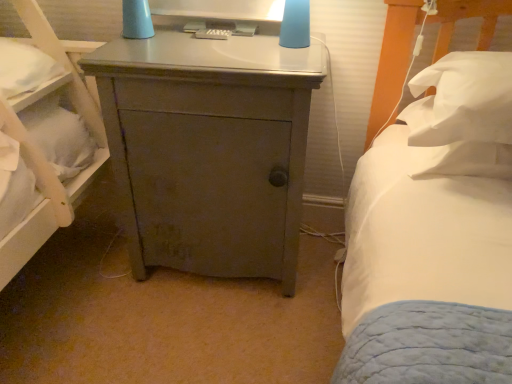
The height and width of the screenshot is (384, 512). What do you see at coordinates (462, 100) in the screenshot? I see `white soft pillow at right, positioned as the second pillow in bottom-to-top order` at bounding box center [462, 100].

Identify the location of matte blue lampshade at upper center. The width and height of the screenshot is (512, 384). (295, 24).

Is matte plastic remote control at upper center looking in the opposite direction of white soft pillow at right, positioned as the second pillow in bottom-to-top order?

No.

Is matte plastic remote control at upper center next to white soft pillow at right, positioned as the second pillow in bottom-to-top order?

No, matte plastic remote control at upper center is not in contact with white soft pillow at right, positioned as the second pillow in bottom-to-top order.

From a real-world perspective, relative to white soft pillow at right, positioned as the second pillow in bottom-to-top order, is matte plastic remote control at upper center vertically above or below?

In terms of real-world spatial position, matte plastic remote control at upper center is above white soft pillow at right, positioned as the second pillow in bottom-to-top order.

From the image's perspective, between matte blue lampshade at upper center and matte gray cabinet at center, which one is located above?

From the image's view, matte blue lampshade at upper center is above.

Consider the image. How many degrees apart are the facing directions of matte blue lampshade at upper center and matte gray cabinet at center?

The angle between the facing direction of matte blue lampshade at upper center and the facing direction of matte gray cabinet at center is 0.49 degrees.

Is matte blue lampshade at upper center at the left side of matte gray cabinet at center?

No, matte blue lampshade at upper center is not to the left of matte gray cabinet at center.

Is matte blue lampshade at upper center beside matte gray cabinet at center?

No, matte blue lampshade at upper center is not making contact with matte gray cabinet at center.

Is matte gray cabinet at center to the right of matte plastic remote control at upper center from the viewer's perspective?

Yes, matte gray cabinet at center is to the right of matte plastic remote control at upper center.

Is the surface of matte gray cabinet at center in direct contact with matte plastic remote control at upper center?

No.

From the image's perspective, between matte gray cabinet at center and matte plastic remote control at upper center, who is located below?

matte gray cabinet at center appears lower in the image.

Looking at their sizes, would you say matte gray cabinet at center is wider or thinner than matte plastic remote control at upper center?

Clearly, matte gray cabinet at center has more width compared to matte plastic remote control at upper center.

Based on their positions, is matte blue lampshade at upper center located to the left or right of white soft pillow at right, placed as the first pillow when sorted from top to bottom?

In the image, matte blue lampshade at upper center appears on the left side of white soft pillow at right, placed as the first pillow when sorted from top to bottom.

Where is `the 2nd pillow counting from the right side of the matte blue lampshade at upper center`? The height and width of the screenshot is (384, 512). the 2nd pillow counting from the right side of the matte blue lampshade at upper center is located at coordinates (462, 100).

From a real-world perspective, which object rests below the other?

In real-world perspective, white soft pillow at right, positioned as the second pillow in bottom-to-top order, is lower.

Would you say matte plastic remote control at upper center is to the left or to the right of matte blue lampshade at upper center in the picture?

Clearly, matte plastic remote control at upper center is on the left of matte blue lampshade at upper center in the image.

Is matte plastic remote control at upper center positioned behind matte blue lampshade at upper center?

Yes, matte plastic remote control at upper center is further from the viewer.

From the image's perspective, which is above, matte plastic remote control at upper center or matte blue lampshade at upper center?

From the image's view, matte plastic remote control at upper center is above.

Would you say matte blue lampshade at upper center is part of matte plastic remote control at upper center's contents?

No, matte plastic remote control at upper center does not contain matte blue lampshade at upper center.

Is the depth of matte blue lampshade at upper center less than that of matte plastic remote control at upper center?

Yes, matte blue lampshade at upper center is closer to the camera.

Who is smaller, matte blue lampshade at upper center or matte plastic remote control at upper center?

matte blue lampshade at upper center is smaller.

What's the angular difference between matte blue lampshade at upper center and matte plastic remote control at upper center's facing directions?

The angle between the facing direction of matte blue lampshade at upper center and the facing direction of matte plastic remote control at upper center is 0.00165 degrees.

Could you tell me if matte blue lampshade at upper center is turned towards matte plastic remote control at upper center?

No.

Is matte blue lampshade at upper center not inside white soft pillow at right, marked as the first pillow in a bottom-to-top arrangement?

matte blue lampshade at upper center lies outside white soft pillow at right, marked as the first pillow in a bottom-to-top arrangement,'s area.

Does point (288, 24) appear closer or farther from the camera than point (468, 164)?

Point (288, 24) is positioned farther from the camera compared to point (468, 164).

Between matte blue lampshade at upper center and white soft pillow at right, which ranks as the second pillow in top-to-bottom order, which one is positioned behind?

matte blue lampshade at upper center is behind.

From a real-world perspective, which object rests below the other?

white soft pillow at right, which ranks as the second pillow in top-to-bottom order, is physically lower.

Find the location of `computer monitor located on the left of white soft pillow at right, positioned as the second pillow in bottom-to-top order`. computer monitor located on the left of white soft pillow at right, positioned as the second pillow in bottom-to-top order is located at coordinates (219, 13).

Image resolution: width=512 pixels, height=384 pixels. What are the coordinates of `nightstand that appears below the matte blue lampshade at upper center (from the image's perspective)` in the screenshot? It's located at (208, 150).

When comparing their distances from matte plastic remote control at upper center, does matte blue lampshade at upper center or white soft pillow at right, positioned as the second pillow in bottom-to-top order, seem closer?

matte blue lampshade at upper center is closer to matte plastic remote control at upper center.

Looking at the image, which one is located further to matte blue lampshade at upper center, matte plastic remote control at upper center or matte gray cabinet at center?

matte gray cabinet at center.

Looking at the image, which one is located closer to white soft pillow at right, placed as the first pillow when sorted from top to bottom, white soft pillow at right, marked as the first pillow in a bottom-to-top arrangement, or matte gray cabinet at center?

Based on the image, white soft pillow at right, marked as the first pillow in a bottom-to-top arrangement, appears to be nearer to white soft pillow at right, placed as the first pillow when sorted from top to bottom.

When comparing their distances from matte blue lampshade at upper center, does white soft pillow at right, placed as the first pillow when sorted from top to bottom, or white soft pillow at right, marked as the first pillow in a bottom-to-top arrangement, seem further?

The object further to matte blue lampshade at upper center is white soft pillow at right, marked as the first pillow in a bottom-to-top arrangement.

Looking at the image, which one is located closer to white soft pillow at right, placed as the first pillow when sorted from top to bottom, white soft pillow at right, marked as the first pillow in a bottom-to-top arrangement, or matte blue lampshade at upper center?

white soft pillow at right, marked as the first pillow in a bottom-to-top arrangement, is positioned closer to the anchor white soft pillow at right, placed as the first pillow when sorted from top to bottom.

Considering their positions, is matte gray cabinet at center positioned further to white soft pillow at right, marked as the first pillow in a bottom-to-top arrangement, than white soft pillow at right, positioned as the second pillow in bottom-to-top order?

The object further to white soft pillow at right, marked as the first pillow in a bottom-to-top arrangement, is matte gray cabinet at center.

Based on the photo, based on their spatial positions, is white soft pillow at right, positioned as the second pillow in bottom-to-top order, or matte plastic remote control at upper center further from white soft pillow at right, marked as the first pillow in a bottom-to-top arrangement?

matte plastic remote control at upper center lies further to white soft pillow at right, marked as the first pillow in a bottom-to-top arrangement, than the other object.

Estimate the real-world distances between objects in this image. Which object is further from matte gray cabinet at center, matte blue lampshade at upper center or white soft pillow at right, positioned as the second pillow in bottom-to-top order?

white soft pillow at right, positioned as the second pillow in bottom-to-top order, lies further to matte gray cabinet at center than the other object.

You are a GUI agent. You are given a task and a screenshot of the screen. Output one action in this format:
    pyautogui.click(x=<x>, y=<y>)
    Task: Click on the bedside lamp between matte gray cabinet at center and white soft pillow at right, positioned as the second pillow in bottom-to-top order, in the horizontal direction
    The width and height of the screenshot is (512, 384).
    Given the screenshot: What is the action you would take?
    pyautogui.click(x=295, y=24)

I want to click on bedside lamp situated between matte gray cabinet at center and white soft pillow at right, marked as the first pillow in a bottom-to-top arrangement, from left to right, so click(295, 24).

I want to click on pillow between matte gray cabinet at center and white soft pillow at right, placed as the first pillow when sorted from top to bottom, in the horizontal direction, so click(x=454, y=144).

I want to click on nightstand located between matte plastic remote control at upper center and white soft pillow at right, marked as the first pillow in a bottom-to-top arrangement, in the left-right direction, so click(208, 150).